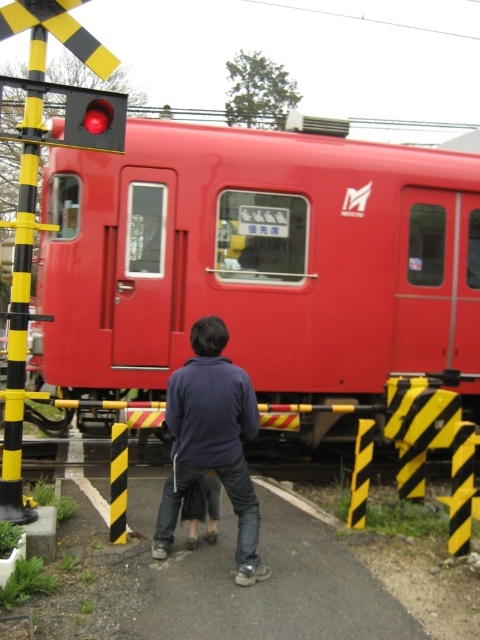
Question: Can you confirm if red matte train at center is thinner than dark blue fleece at center?

Choices:
 (A) yes
 (B) no

Answer: (B)

Question: Is red matte train at center below yellow/black striped pole at left?

Choices:
 (A) no
 (B) yes

Answer: (B)

Question: Which object is the farthest from the matte red button at upper left?

Choices:
 (A) dark blue fleece at center
 (B) yellow/black striped pole at left

Answer: (A)

Question: Estimate the real-world distances between objects in this image. Which object is farther from the red matte train at center?

Choices:
 (A) dark blue fleece at center
 (B) matte red button at upper left

Answer: (B)

Question: Which point appears closest to the camera in this image?

Choices:
 (A) (99, 120)
 (B) (288, 186)

Answer: (A)

Question: Can you confirm if red matte train at center is positioned above dark blue fleece at center?

Choices:
 (A) no
 (B) yes

Answer: (B)